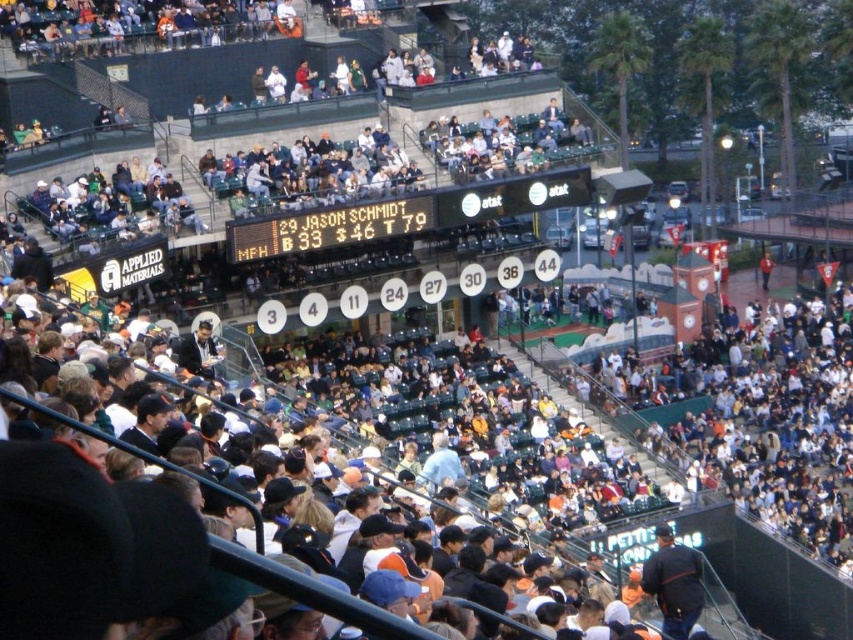
You are a stadium employee who needs to update both the black plastic scoreboard at upper center and the black digital scoreboard at center. Which scoreboard requires a ladder to reach due to its height?

The black plastic scoreboard at upper center requires a ladder to reach because it is larger in size than the black digital scoreboard at center, implying it is positioned higher up.

You are a maintenance worker needing to reach both the black plastic scoreboard at upper center and the black digital scoreboard at center. If you have a ladder that is 3 feet long, can you safely reach both scoreboards without moving the ladder?

The distance between the black plastic scoreboard at upper center and the black digital scoreboard at center is 3.31 feet. Since the ladder is only 3 feet long, it is too short to span the distance between them. You would need to move the ladder to reach both scoreboards safely.

You are a photographer at the baseball stadium and want to capture both the black plastic scoreboard at upper center and the black digital scoreboard at center in a single shot. Which scoreboard will occupy more space in the photo?

The black plastic scoreboard at upper center will occupy more space in the photo because its width is larger than the black digital scoreboard at center.